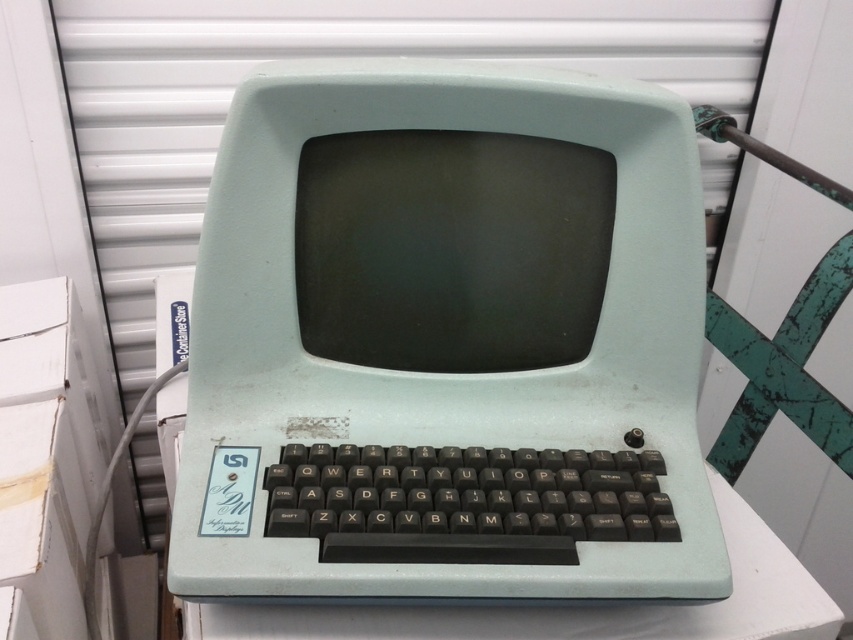
Question: Which point is closer to the camera taking this photo?

Choices:
 (A) (556, 371)
 (B) (637, 611)

Answer: (B)

Question: Which object appears farthest from the camera in this image?

Choices:
 (A) matte plastic computer at center
 (B) white plastic keyboard at center

Answer: (B)

Question: Does matte plastic computer at center appear under white plastic keyboard at center?

Choices:
 (A) yes
 (B) no

Answer: (B)

Question: Which point is farther to the camera?

Choices:
 (A) matte plastic computer at center
 (B) white plastic keyboard at center

Answer: (B)

Question: From the image, what is the correct spatial relationship of matte plastic computer at center in relation to white plastic keyboard at center?

Choices:
 (A) above
 (B) below

Answer: (A)

Question: Does matte plastic computer at center appear under white plastic keyboard at center?

Choices:
 (A) yes
 (B) no

Answer: (B)